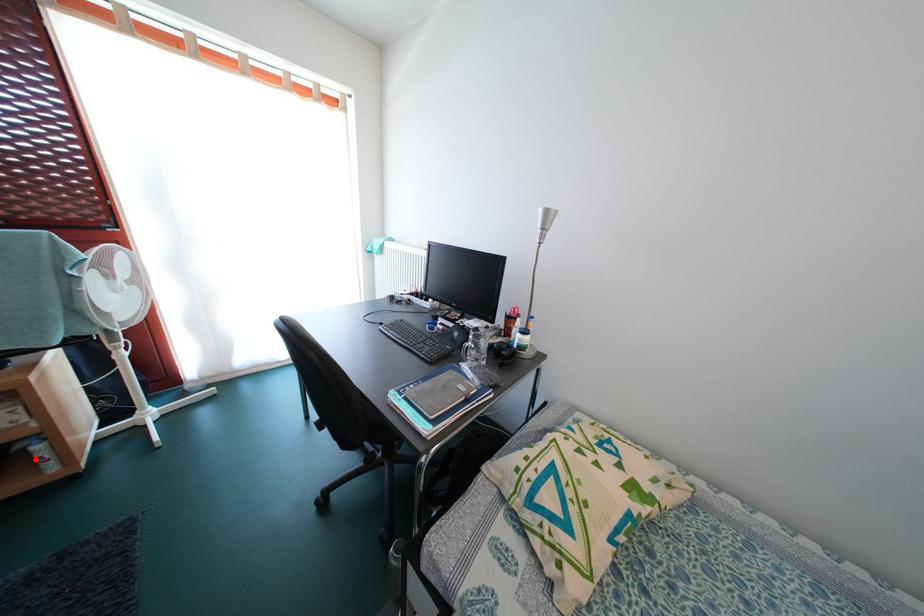
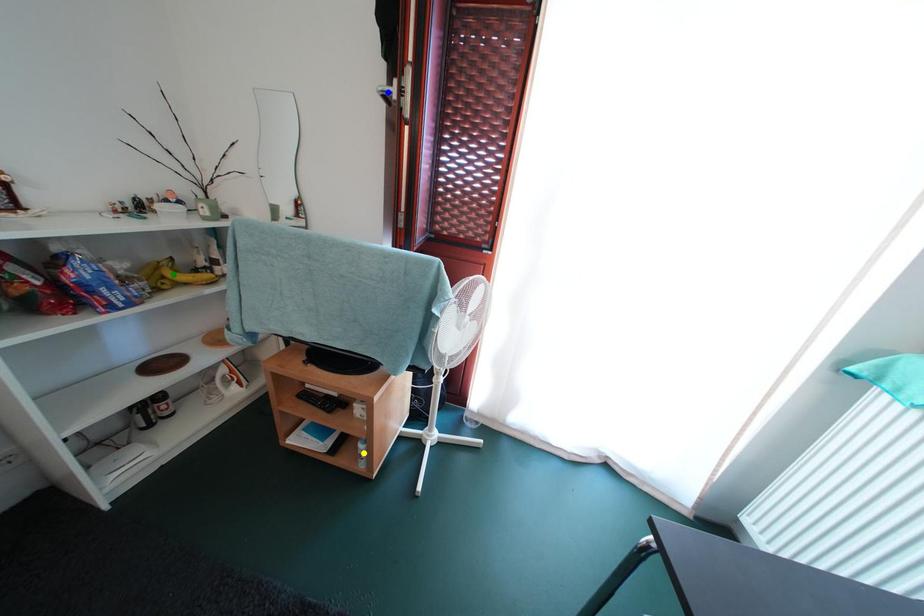
Question: I am providing you with two images of the same scene from different viewpoints. A red point is marked on the first image. You are given multiple points on the second image. Which point in image 2 is actually the same real-world point as the red point in image 1?

Choices:
 (A) blue point
 (B) yellow point
 (C) green point

Answer: (B)